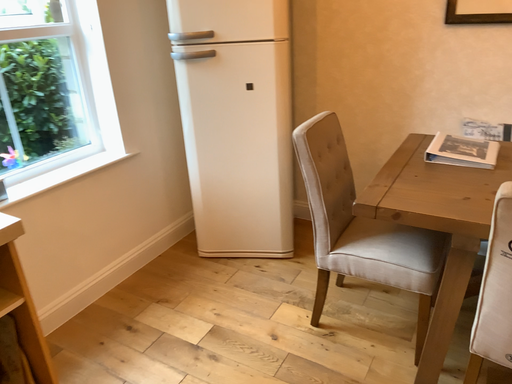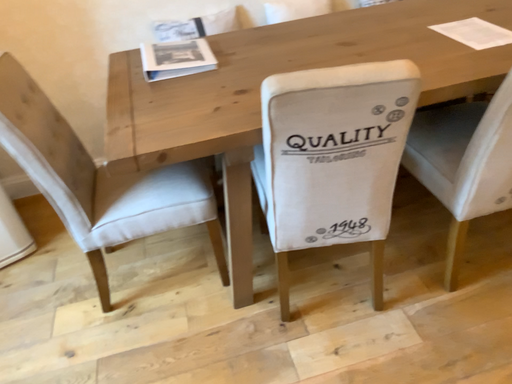
Question: Which way did the camera rotate in the video?

Choices:
 (A) rotated right
 (B) rotated left

Answer: (A)